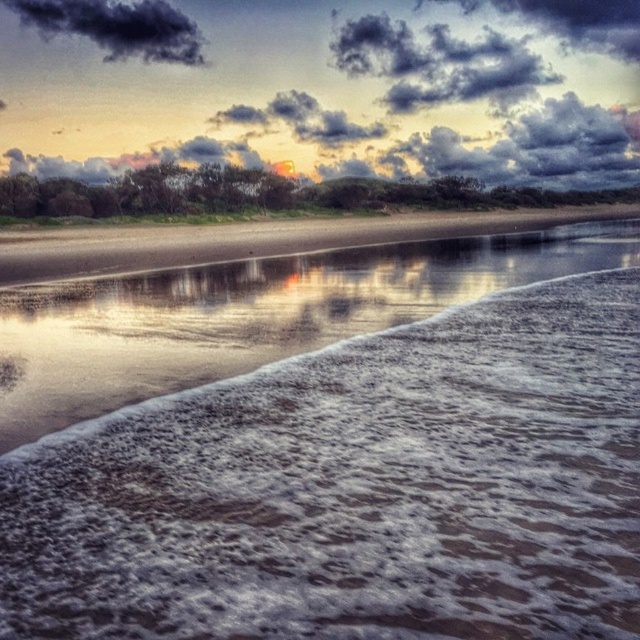
You are a photographer trying to capture the sunset at the beach. You want to position your camera so that the dark gray fluffy cloud at upper left is in the center of your shot. Given that the camera has a field of view of 60 degrees, can you estimate whether the cloud will fit entirely within the frame?

The dark gray fluffy cloud at upper left is located at point coordinates of (118, 26). Since the camera has a 60 degree field of view, the photographer can adjust the camera angle to ensure the cloud at upper left fits within the frame.

You are an artist painting the sky in this beach scene. You need to place the dark textured cloud at upper center and the dark gray fluffy cloud at upper center accurately. Which cloud is positioned to the right side of the other?

The dark textured cloud at upper center is positioned to the right of the dark gray fluffy cloud at upper center.

You are a weather observer analyzing the clouds in the sky. You notice two clouds, the dark textured cloud at upper center and the dark gray fluffy cloud at upper center. Which one do you think has a greater area coverage?

The dark textured cloud at upper center has a greater area coverage than the dark gray fluffy cloud at upper center because it is larger in size according to the description.